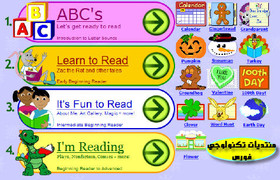
At what (x,y) coordinates should I click in order to perform the action: click on letter blocks. Please return your answer as a coordinate pair (x, y). Image resolution: width=280 pixels, height=180 pixels. Looking at the image, I should click on (20, 26), (35, 13), (41, 28).